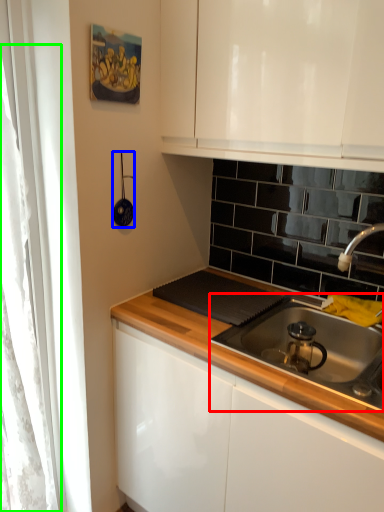
Question: Considering the real-world distances, which object is farthest from gas stove (highlighted by a red box)? appliance (highlighted by a blue box) or curtain (highlighted by a green box)?

Choices:
 (A) appliance
 (B) curtain

Answer: (B)